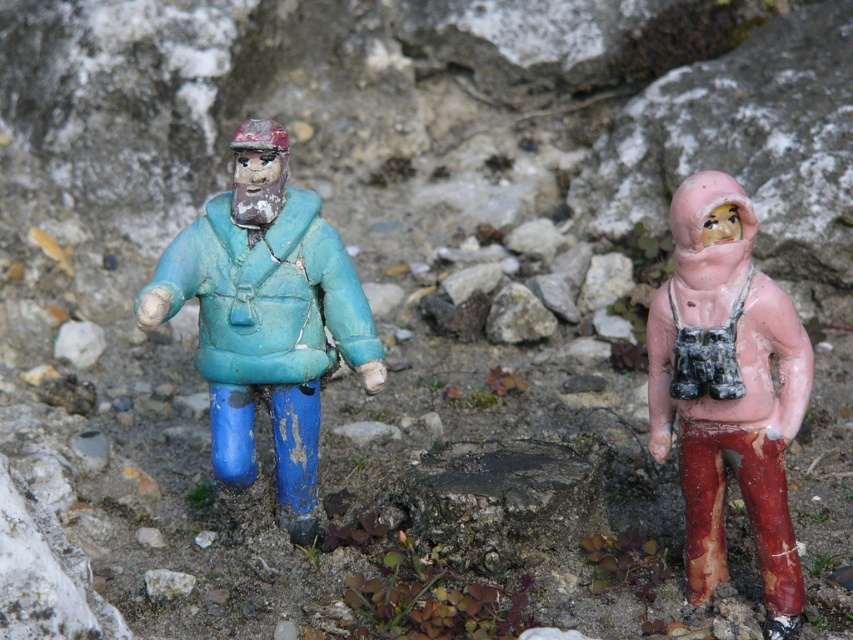
Question: Can you confirm if matte blue plastic figure at left is bigger than pink matte figure at right?

Choices:
 (A) yes
 (B) no

Answer: (A)

Question: Which point is farther from the camera taking this photo?

Choices:
 (A) (712, 410)
 (B) (297, 433)

Answer: (B)

Question: Which point appears closest to the camera in this image?

Choices:
 (A) (721, 273)
 (B) (368, 385)

Answer: (A)

Question: Is matte blue plastic figure at left smaller than pink matte figure at right?

Choices:
 (A) yes
 (B) no

Answer: (B)

Question: Can you confirm if matte blue plastic figure at left is smaller than pink matte figure at right?

Choices:
 (A) yes
 (B) no

Answer: (B)

Question: Which object appears farthest from the camera in this image?

Choices:
 (A) matte blue plastic figure at left
 (B) pink matte figure at right

Answer: (A)